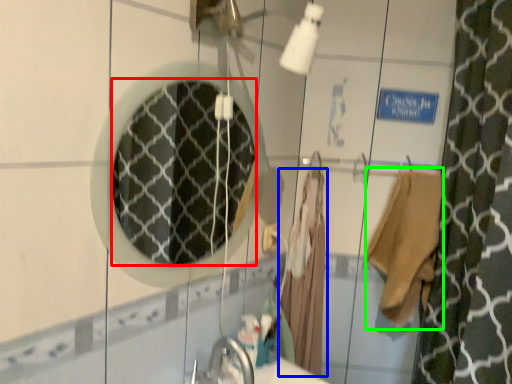
Question: Which is nearer to the mirror (highlighted by a red box)? bathrobe (highlighted by a blue box) or robe (highlighted by a green box).

Choices:
 (A) bathrobe
 (B) robe

Answer: (A)